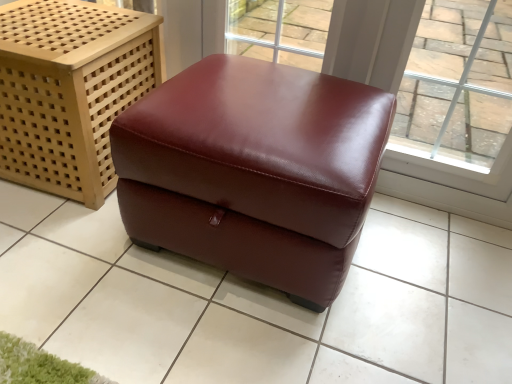
Where is `free space in front of burgundy leather ottoman at center, marked as the first furniture in a left-to-right arrangement`? free space in front of burgundy leather ottoman at center, marked as the first furniture in a left-to-right arrangement is located at coordinates (62, 247).